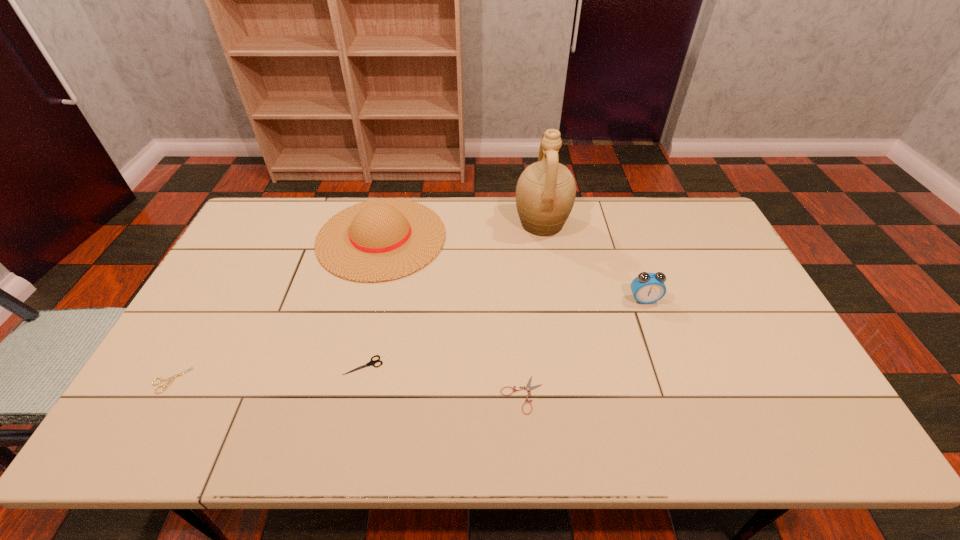
You are a GUI agent. You are given a task and a screenshot of the screen. Output one action in this format:
    pyautogui.click(x=<x>, y=<y>)
    Task: Click on the vacant area at the far edge
    
    Given the screenshot: What is the action you would take?
    pyautogui.click(x=514, y=238)

Identify the location of vacant space at the near edge of the desktop. The image size is (960, 540). (621, 418).

Where is `vacant space at the left edge of the desktop`? The image size is (960, 540). vacant space at the left edge of the desktop is located at coordinates (219, 273).

At what (x,y) coordinates should I click in order to perform the action: click on vacant space at the right edge of the desktop. Please return your answer as a coordinate pair (x, y). Looking at the image, I should click on point(730,251).

Identify the location of vacant region at the far left corner. The image size is (960, 540). (276, 224).

You are a GUI agent. You are given a task and a screenshot of the screen. Output one action in this format:
    pyautogui.click(x=<x>, y=<y>)
    Task: Click on the vacant point at the far right corner
    
    Given the screenshot: What is the action you would take?
    pyautogui.click(x=699, y=226)

Locate an element on the screen. The height and width of the screenshot is (540, 960). free point at the near right corner is located at coordinates (798, 422).

This screenshot has height=540, width=960. Find the location of `empty location between the bonnet and the rightmost object`. empty location between the bonnet and the rightmost object is located at coordinates (513, 268).

You are a GUI agent. You are given a task and a screenshot of the screen. Output one action in this format:
    pyautogui.click(x=<x>, y=<y>)
    Task: Click on the empty location between the leftmost object and the bonnet
    Image resolution: width=960 pixels, height=540 pixels.
    Given the screenshot: What is the action you would take?
    pos(276,309)

Identify the location of vacant area that lies between the bonnet and the second shortest object. The width and height of the screenshot is (960, 540). (276, 309).